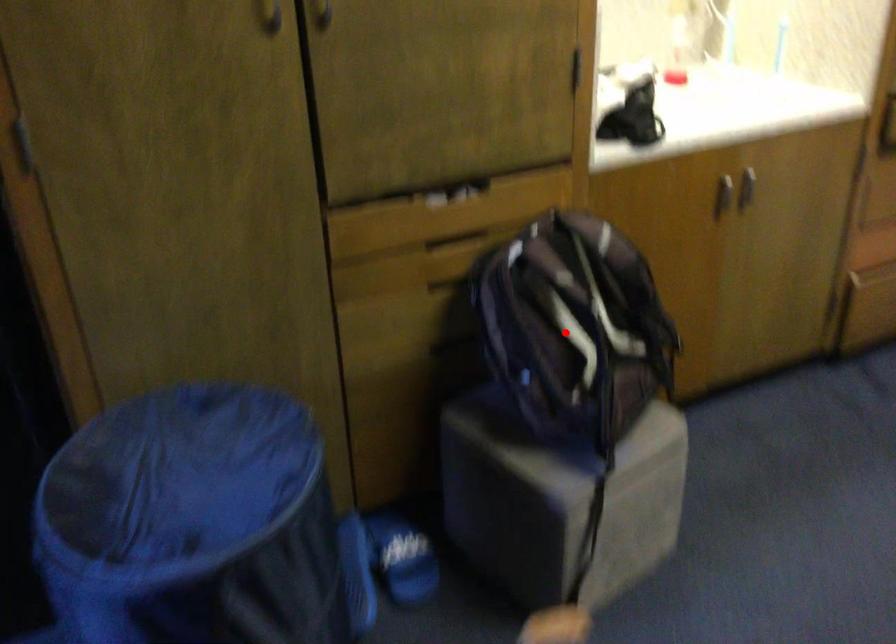
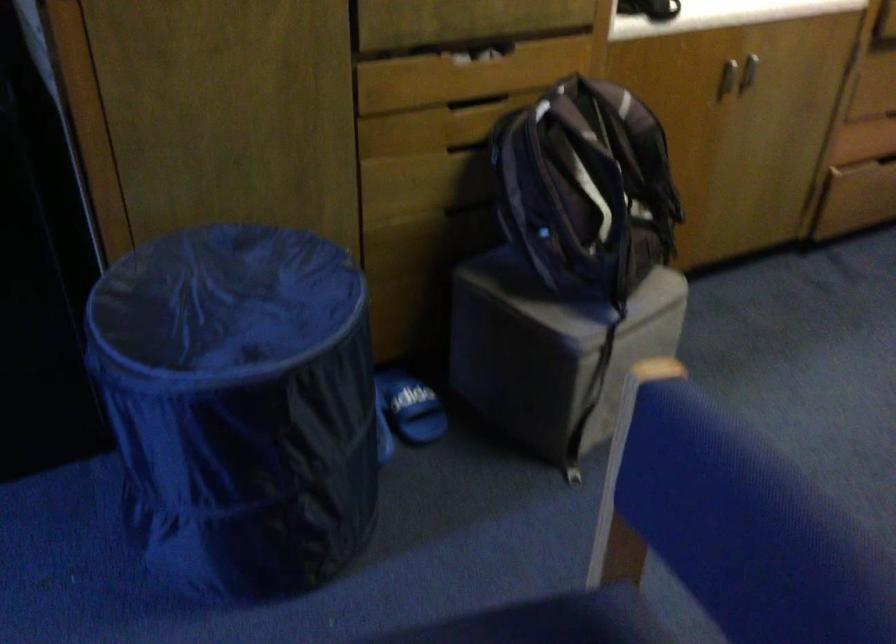
Where in the second image is the point corresponding to the highlighted location from the first image?

(586, 187)